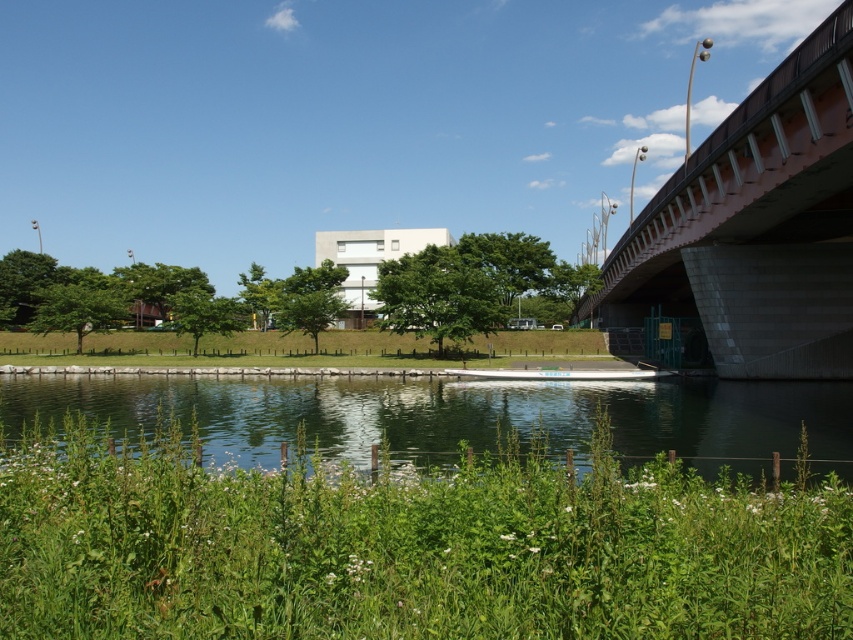
Looking at this image, can you confirm if concrete bridge at right is positioned above green grass at center?

Correct, concrete bridge at right is located above green grass at center.

Who is shorter, concrete bridge at right or green grass at center?

green grass at center is shorter.

Describe the element at coordinates (757, 225) in the screenshot. I see `concrete bridge at right` at that location.

Find the location of a particular element. This screenshot has width=853, height=640. concrete bridge at right is located at coordinates (757, 225).

Does point (251, 410) lie behind point (97, 333)?

That is False.

Is transparent water at center above green grass at center?

No, transparent water at center is not above green grass at center.

You are a GUI agent. You are given a task and a screenshot of the screen. Output one action in this format:
    pyautogui.click(x=<x>, y=<y>)
    Task: Click on the transparent water at center
    This screenshot has height=640, width=853.
    Given the screenshot: What is the action you would take?
    pyautogui.click(x=459, y=417)

In order to click on transparent water at center in this screenshot , I will do `click(459, 417)`.

Does transparent water at center have a greater height compared to concrete bridge at right?

In fact, transparent water at center may be shorter than concrete bridge at right.

Is point (589, 387) behind point (782, 157)?

Yes, it is.

The width and height of the screenshot is (853, 640). Identify the location of transparent water at center. (459, 417).

At what (x,y) coordinates should I click in order to perform the action: click on transparent water at center. Please return your answer as a coordinate pair (x, y). This screenshot has width=853, height=640. Looking at the image, I should click on pyautogui.click(x=459, y=417).